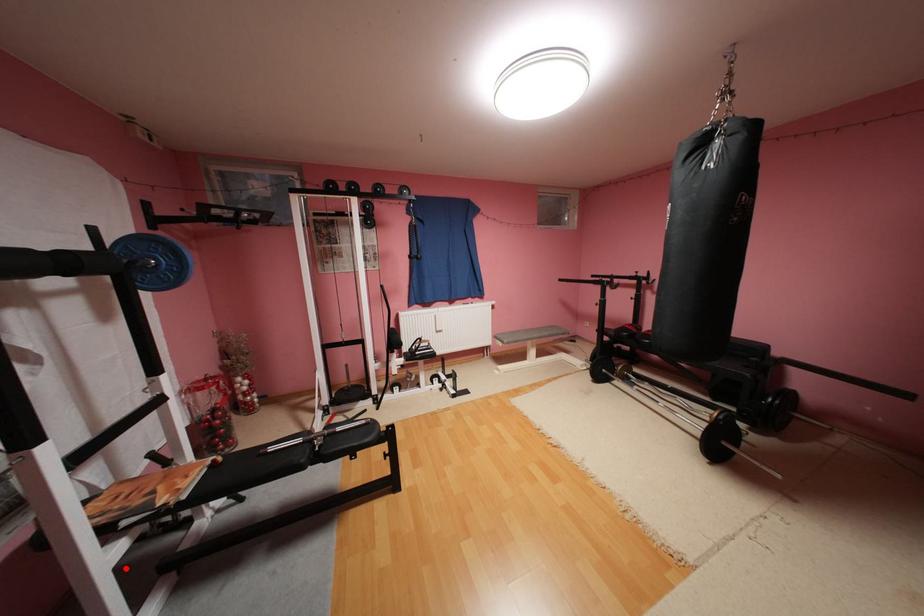
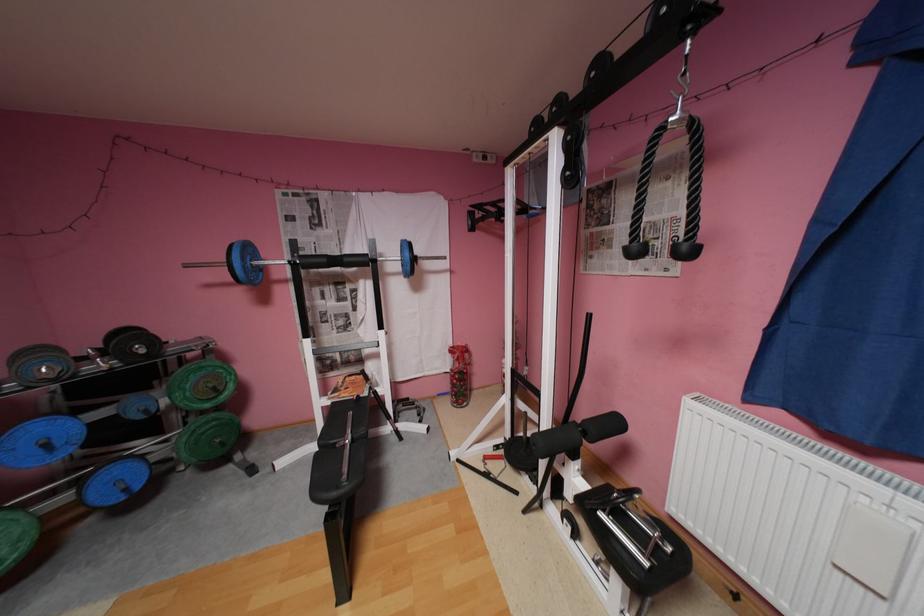
The point at the highlighted location is marked in the first image. Where is the corresponding point in the second image?

(333, 408)